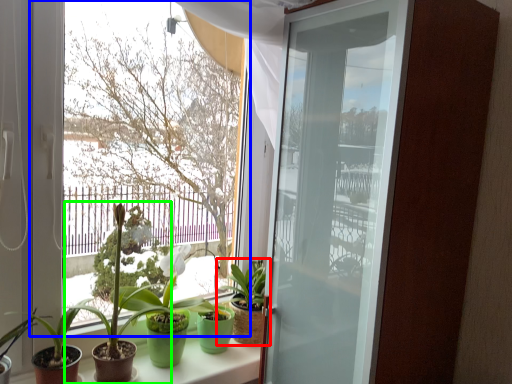
Question: Which object is positioned closest to houseplant (highlighted by a red box)? Select from window (highlighted by a blue box) and houseplant (highlighted by a green box).

Choices:
 (A) window
 (B) houseplant

Answer: (B)